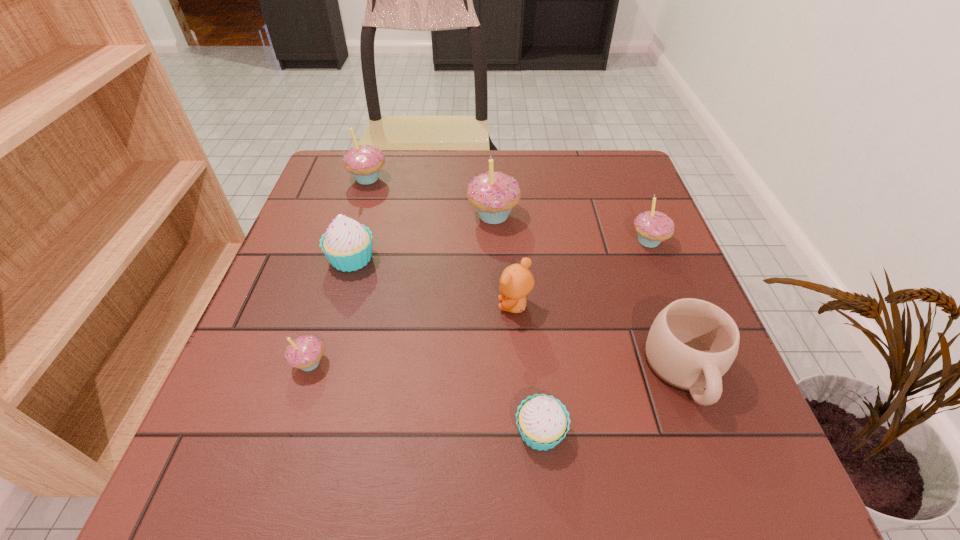
The height and width of the screenshot is (540, 960). What are the coordinates of `pink cupcake that stands as the second closest to the farthest cupcake` in the screenshot? It's located at (304, 352).

Where is `vacant space that satisfies the following two spatial constraints: 1. on the back side of the tallest object; 2. on the right side of the smallest pink cupcake`? Image resolution: width=960 pixels, height=540 pixels. vacant space that satisfies the following two spatial constraints: 1. on the back side of the tallest object; 2. on the right side of the smallest pink cupcake is located at coordinates (356, 215).

This screenshot has width=960, height=540. In order to click on free region that satisfies the following two spatial constraints: 1. on the back side of the rightmost pink cupcake; 2. on the right side of the nearest cupcake in this screenshot , I will do `click(521, 241)`.

Image resolution: width=960 pixels, height=540 pixels. What are the coordinates of `vacant point that satisfies the following two spatial constraints: 1. on the face of the fourth nearest object; 2. on the left side of the nearest cupcake` in the screenshot? It's located at (524, 431).